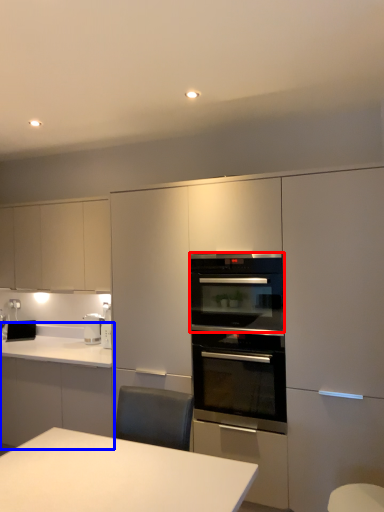
Question: Which of the following is the closest to the observer, oven (highlighted by a red box) or countertop (highlighted by a blue box)?

Choices:
 (A) oven
 (B) countertop

Answer: (A)